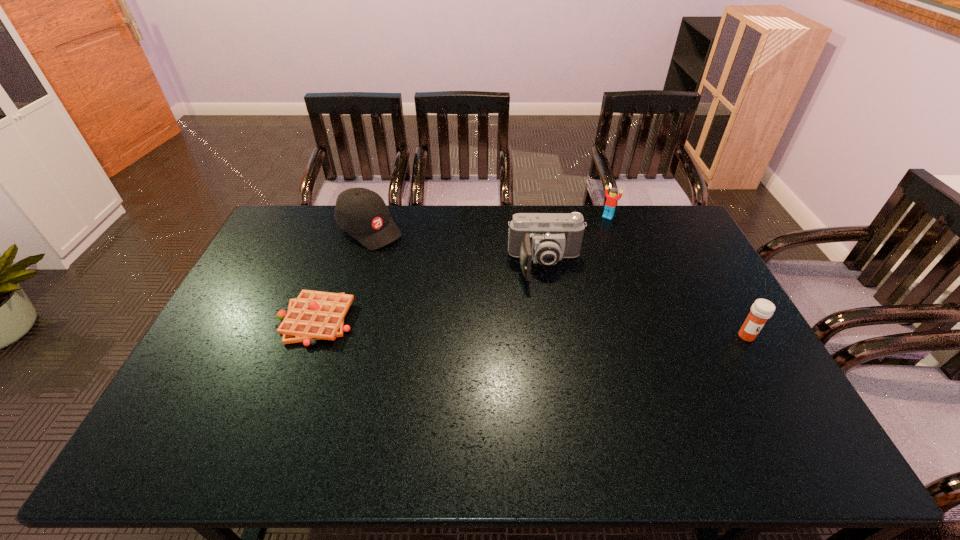
Where is `free space located 0.280m with a logo on the front of the baseball cap`? Image resolution: width=960 pixels, height=540 pixels. free space located 0.280m with a logo on the front of the baseball cap is located at coordinates (441, 284).

This screenshot has width=960, height=540. Identify the location of vacant space located 0.160m with a logo on the front of the baseball cap. (418, 266).

This screenshot has height=540, width=960. I want to click on free space located 0.180m with a logo on the front of the baseball cap, so click(x=421, y=268).

The image size is (960, 540). Find the location of `vacant space located at the front of the third object from right to left with an open lens cover`. vacant space located at the front of the third object from right to left with an open lens cover is located at coordinates (563, 383).

The width and height of the screenshot is (960, 540). Identify the location of vacant space located 0.400m at the front of the third object from right to left with an open lens cover. (564, 393).

At what (x,y) coordinates should I click in order to perform the action: click on free space located 0.270m at the front of the third object from right to left with an open lens cover. Please return your answer as a coordinate pair (x, y). Looking at the image, I should click on (558, 352).

Find the location of a particular element. Image resolution: width=960 pixels, height=540 pixels. Lego positioned at the far edge is located at coordinates (612, 198).

Where is `baseball cap located at the far edge`? The image size is (960, 540). baseball cap located at the far edge is located at coordinates [x=362, y=213].

You are a GUI agent. You are given a task and a screenshot of the screen. Output one action in this format:
    pyautogui.click(x=<x>, y=<y>)
    Task: Click on the object that is positioned at the right edge
    
    Given the screenshot: What is the action you would take?
    pyautogui.click(x=761, y=310)

Locate an element on the screen. This screenshot has height=540, width=960. free location at the far edge is located at coordinates (623, 234).